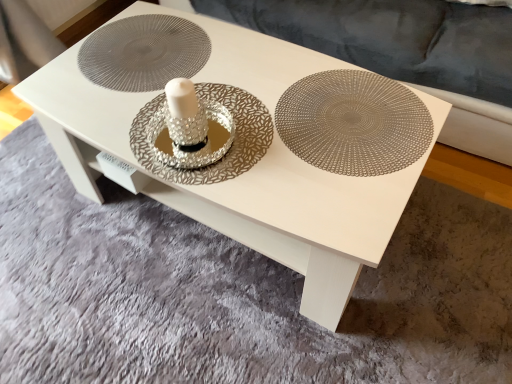
This screenshot has width=512, height=384. Identify the location of metallic silver doily at center. (144, 52).

This screenshot has height=384, width=512. What do you see at coordinates (353, 123) in the screenshot? I see `metallic silver plate at center` at bounding box center [353, 123].

The height and width of the screenshot is (384, 512). What are the coordinates of `velvet grey couch at upper center` in the screenshot? It's located at (407, 53).

From the image's perspective, which object appears higher, velvet grey couch at upper center or metallic silver doily at center?

velvet grey couch at upper center, from the image's perspective.

Is velvet grey couch at upper center placed right next to metallic silver doily at center?

velvet grey couch at upper center and metallic silver doily at center are clearly separated.

Based on the photo, in the image, is velvet grey couch at upper center positioned in front of or behind metallic silver doily at center?

Visually, velvet grey couch at upper center is located in front of metallic silver doily at center.

From a real-world perspective, does velvet grey couch at upper center sit lower than metallic silver doily at center?

Yes.

Is velvet grey couch at upper center next to metallic silver plate at center and touching it?

velvet grey couch at upper center and metallic silver plate at center are clearly separated.

From the image's perspective, does velvet grey couch at upper center appear higher than metallic silver plate at center?

Correct, velvet grey couch at upper center appears higher than metallic silver plate at center in the image.

Considering the sizes of velvet grey couch at upper center and metallic silver plate at center in the image, is velvet grey couch at upper center taller or shorter than metallic silver plate at center?

In the image, velvet grey couch at upper center appears to be taller than metallic silver plate at center.

From the picture: Could metallic silver plate at center be considered to be inside velvet grey couch at upper center?

No, metallic silver plate at center is located outside of velvet grey couch at upper center.

Locate an element on the screen. couch to the right of metallic silver doily at center is located at coordinates (407, 53).

Can you confirm if metallic silver doily at center is wider than velvet grey couch at upper center?

No, metallic silver doily at center is not wider than velvet grey couch at upper center.

Is point (94, 80) more distant than point (450, 77)?

No, (94, 80) is in front of (450, 77).

Is metallic silver doily at center surrounding velvet grey couch at upper center?

No, metallic silver doily at center does not contain velvet grey couch at upper center.

What's the angular difference between metallic silver plate at center and velvet grey couch at upper center's facing directions?

There is a 1.16-degree angle between the facing directions of metallic silver plate at center and velvet grey couch at upper center.

Which object is further away from the camera, metallic silver plate at center or velvet grey couch at upper center?

velvet grey couch at upper center is behind.

Between metallic silver plate at center and velvet grey couch at upper center, which one has less height?

metallic silver plate at center.

Looking at this image, is metallic silver plate at center looking in the opposite direction of velvet grey couch at upper center?

Correct, metallic silver plate at center is looking away from velvet grey couch at upper center.

Considering the points (376, 90) and (202, 43), which point is in front, point (376, 90) or point (202, 43)?

The point (376, 90) is more forward.

Does metallic silver plate at center have a smaller size compared to metallic silver doily at center?

Correct, metallic silver plate at center occupies less space than metallic silver doily at center.

Looking at their sizes, would you say metallic silver plate at center is wider or thinner than metallic silver doily at center?

metallic silver plate at center is thinner than metallic silver doily at center.

In the scene shown: From a real-world perspective, relative to metallic silver plate at center, is metallic silver doily at center vertically above or below?

metallic silver doily at center is situated lower than metallic silver plate at center in the real world.

Looking at this image, how much distance is there between metallic silver doily at center and metallic silver plate at center?

metallic silver doily at center is 18.77 inches from metallic silver plate at center.

Is the depth of metallic silver doily at center greater than that of metallic silver plate at center?

Yes, it is behind metallic silver plate at center.

From the image's perspective, between metallic silver doily at center and metallic silver plate at center, which one is located above?

metallic silver doily at center appears higher in the image.

The width and height of the screenshot is (512, 384). I want to click on couch above the metallic silver doily at center (from the image's perspective), so click(407, 53).

Where is `plate in front of the velvet grey couch at upper center`? plate in front of the velvet grey couch at upper center is located at coordinates (353, 123).

Looking at the image, which one is located closer to metallic silver doily at center, velvet grey couch at upper center or metallic silver plate at center?

The object closer to metallic silver doily at center is metallic silver plate at center.

Looking at the image, which one is located closer to velvet grey couch at upper center, metallic silver plate at center or metallic silver doily at center?

metallic silver plate at center lies closer to velvet grey couch at upper center than the other object.

Considering their positions, is metallic silver plate at center positioned further to metallic silver doily at center than velvet grey couch at upper center?

velvet grey couch at upper center.

Considering their positions, is metallic silver doily at center positioned further to velvet grey couch at upper center than metallic silver plate at center?

metallic silver doily at center lies further to velvet grey couch at upper center than the other object.

From the image, which object appears to be nearer to metallic silver plate at center, metallic silver doily at center or velvet grey couch at upper center?

Among the two, metallic silver doily at center is located nearer to metallic silver plate at center.

Considering their positions, is velvet grey couch at upper center positioned further to metallic silver plate at center than metallic silver doily at center?

velvet grey couch at upper center is positioned further to the anchor metallic silver plate at center.

You are a GUI agent. You are given a task and a screenshot of the screen. Output one action in this format:
    pyautogui.click(x=<x>, y=<y>)
    Task: Click on the plate located between metallic silver doily at center and velvet grey couch at upper center in the left-right direction
    The width and height of the screenshot is (512, 384).
    Given the screenshot: What is the action you would take?
    pyautogui.click(x=353, y=123)